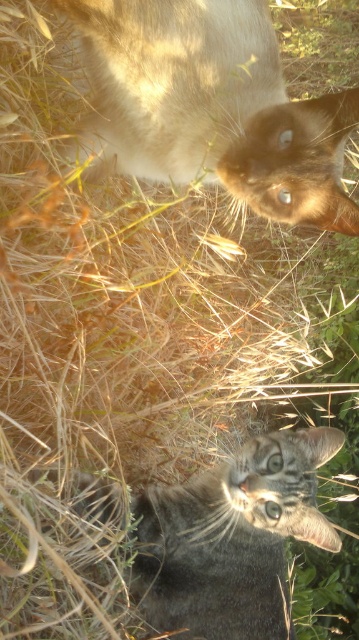
You are a photographer trying to capture both the brown fur cat at upper center and the gray tabby cat at lower center in a single shot. Based on their positions, which cat is closer to the camera?

The gray tabby cat at lower center is closer to the camera because the brown fur cat at upper center is positioned over it, indicating depth where the upper cat is farther away.

You are standing at the point marked as point (x=249, y=0) in the image. You want to walk towards the gray tabby kitten lying in the foreground. How far will you have to walk to reach the kitten?

The distance between point (x=249, y=0) and the viewer is 5.11 feet, so you will have to walk 5.11 feet to reach the gray tabby kitten lying in the foreground.